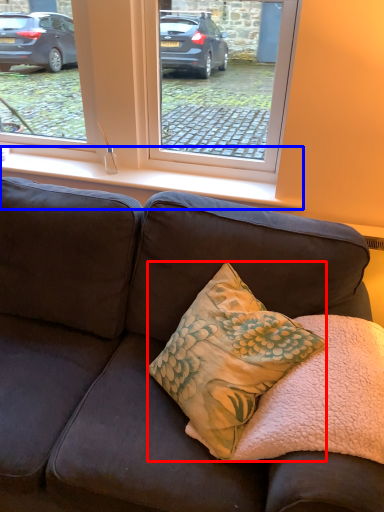
Question: Which object appears closest to the camera in this image, pillow (highlighted by a red box) or window sill (highlighted by a blue box)?

Choices:
 (A) pillow
 (B) window sill

Answer: (A)